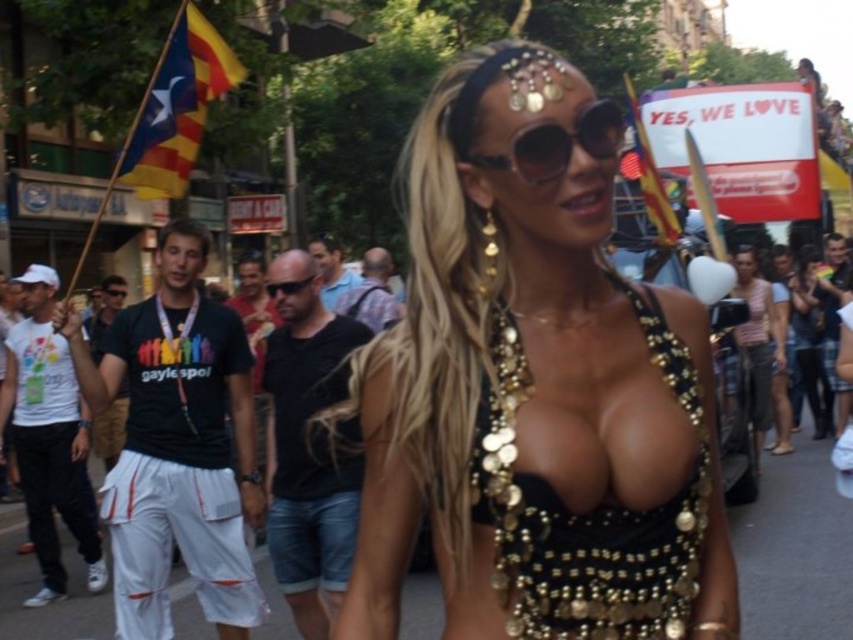
You are standing in the street scene and want to determine the relative positions of two points marked in the image. Which point is nearer to you, point 1 at coordinates (196, 51) or point 2 at coordinates (798, 406)?

Point 1 at coordinates (196, 51) is closer to the viewer than point 2 at coordinates (798, 406).